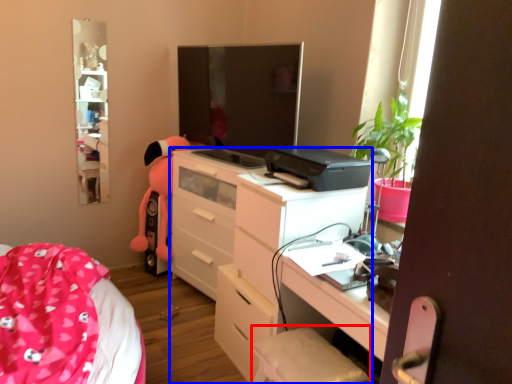
Question: Which object appears closest to the camera in this image, swivel chair (highlighted by a red box) or chest of drawers (highlighted by a blue box)?

Choices:
 (A) swivel chair
 (B) chest of drawers

Answer: (A)